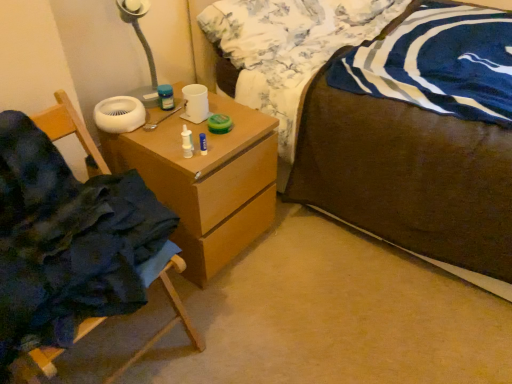
Question: Considering the relative sizes of fluffy white pillow at upper center and wooden chest of drawers at center in the image provided, is fluffy white pillow at upper center taller than wooden chest of drawers at center?

Choices:
 (A) yes
 (B) no

Answer: (B)

Question: Does fluffy white pillow at upper center turn towards wooden chest of drawers at center?

Choices:
 (A) yes
 (B) no

Answer: (B)

Question: Is fluffy white pillow at upper center smaller than wooden chest of drawers at center?

Choices:
 (A) no
 (B) yes

Answer: (B)

Question: Considering the relative sizes of fluffy white pillow at upper center and wooden chest of drawers at center in the image provided, is fluffy white pillow at upper center shorter than wooden chest of drawers at center?

Choices:
 (A) yes
 (B) no

Answer: (A)

Question: Are fluffy white pillow at upper center and wooden chest of drawers at center beside each other?

Choices:
 (A) no
 (B) yes

Answer: (A)

Question: From their relative heights in the image, would you say brown wooden bed at center is taller or shorter than fluffy white pillow at upper center?

Choices:
 (A) short
 (B) tall

Answer: (B)

Question: Considering their positions, is brown wooden bed at center located in front of or behind fluffy white pillow at upper center?

Choices:
 (A) behind
 (B) front

Answer: (B)

Question: Looking at their shapes, would you say brown wooden bed at center is wider or thinner than fluffy white pillow at upper center?

Choices:
 (A) thin
 (B) wide

Answer: (B)

Question: Considering the positions of brown wooden bed at center and fluffy white pillow at upper center in the image, is brown wooden bed at center bigger or smaller than fluffy white pillow at upper center?

Choices:
 (A) small
 (B) big

Answer: (B)

Question: From the image's perspective, relative to wooden chair at left, is fluffy white pillow at upper center above or below?

Choices:
 (A) below
 (B) above

Answer: (B)

Question: Is point (260, 59) positioned closer to the camera than point (180, 269)?

Choices:
 (A) closer
 (B) farther

Answer: (B)

Question: Looking at their shapes, would you say fluffy white pillow at upper center is wider or thinner than wooden chair at left?

Choices:
 (A) thin
 (B) wide

Answer: (A)

Question: Is fluffy white pillow at upper center inside or outside of wooden chair at left?

Choices:
 (A) outside
 (B) inside

Answer: (A)

Question: In terms of size, does fluffy white pillow at upper center appear bigger or smaller than brown wooden bed at center?

Choices:
 (A) small
 (B) big

Answer: (A)

Question: Choose the correct answer: Is fluffy white pillow at upper center inside brown wooden bed at center or outside it?

Choices:
 (A) inside
 (B) outside

Answer: (A)